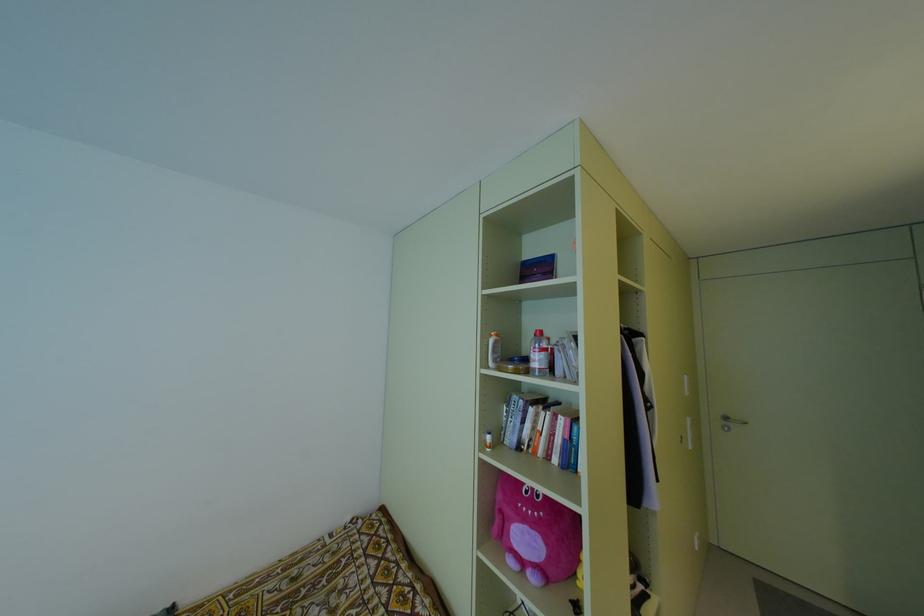
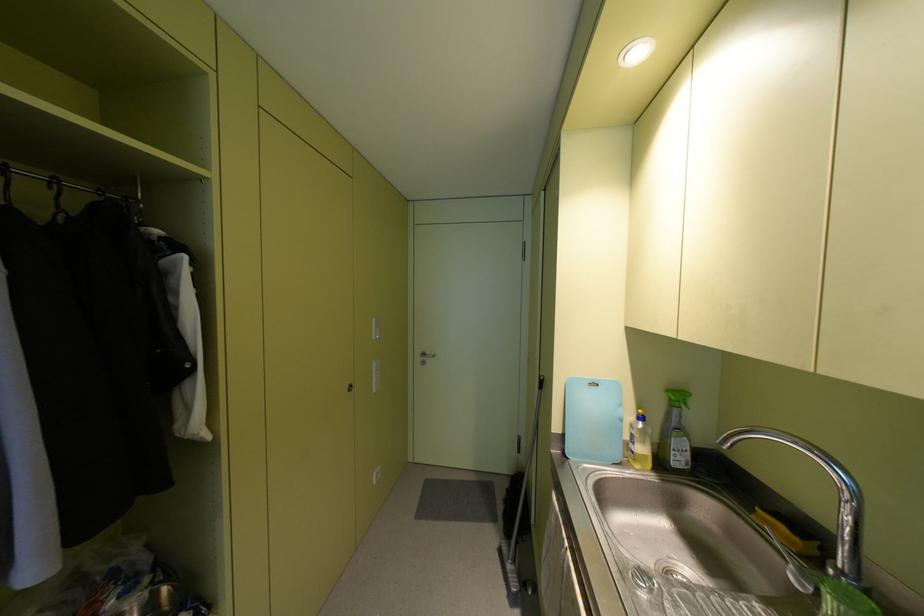
Where in the second image is the point corresponding to pixel 724 418 from the first image?

(422, 354)